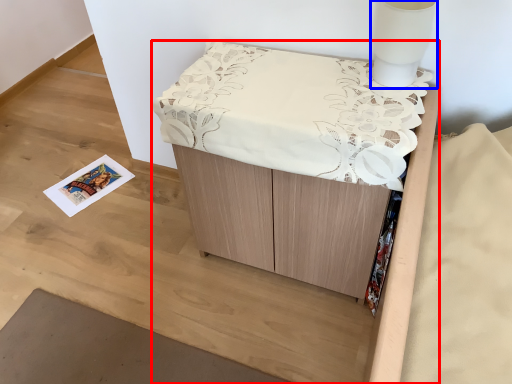
Question: Which object is closer to the camera taking this photo, furniture (highlighted by a red box) or table lamp (highlighted by a blue box)?

Choices:
 (A) furniture
 (B) table lamp

Answer: (A)